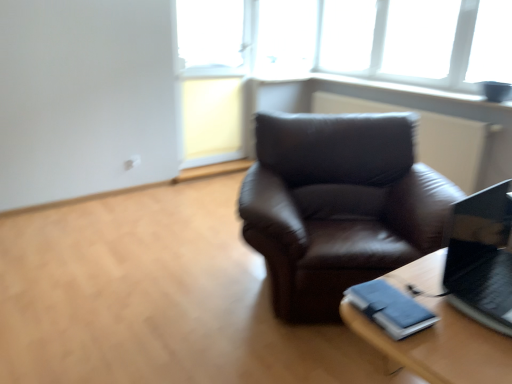
Question: Considering the relative positions of transparent glass window at upper center and wooden table at lower right in the image provided, is transparent glass window at upper center to the left or to the right of wooden table at lower right?

Choices:
 (A) right
 (B) left

Answer: (A)

Question: Looking at their shapes, would you say transparent glass window at upper center is wider or thinner than wooden table at lower right?

Choices:
 (A) thin
 (B) wide

Answer: (A)

Question: Estimate the real-world distances between objects in this image. Which object is farther from the shiny black laptop at right?

Choices:
 (A) wooden table at lower right
 (B) transparent glass window at upper center
 (C) blue fabric binder at lower right

Answer: (B)

Question: Considering the real-world distances, which object is closest to the blue fabric binder at lower right?

Choices:
 (A) shiny black laptop at right
 (B) wooden table at lower right
 (C) transparent glass window at upper center

Answer: (B)